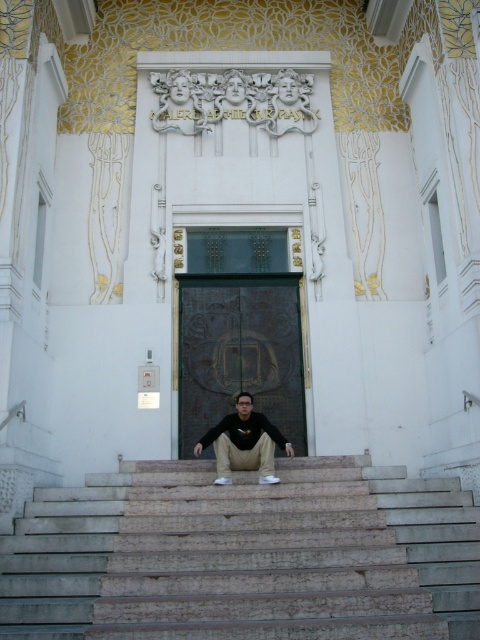
Question: Is marble stairs at center thinner than black matte shirt at center?

Choices:
 (A) yes
 (B) no

Answer: (B)

Question: Which point is closer to the camera?

Choices:
 (A) marble stairs at center
 (B) black matte shirt at center

Answer: (A)

Question: Can you confirm if marble stairs at center is wider than black matte shirt at center?

Choices:
 (A) no
 (B) yes

Answer: (B)

Question: Can you confirm if marble stairs at center is positioned below black matte shirt at center?

Choices:
 (A) yes
 (B) no

Answer: (A)